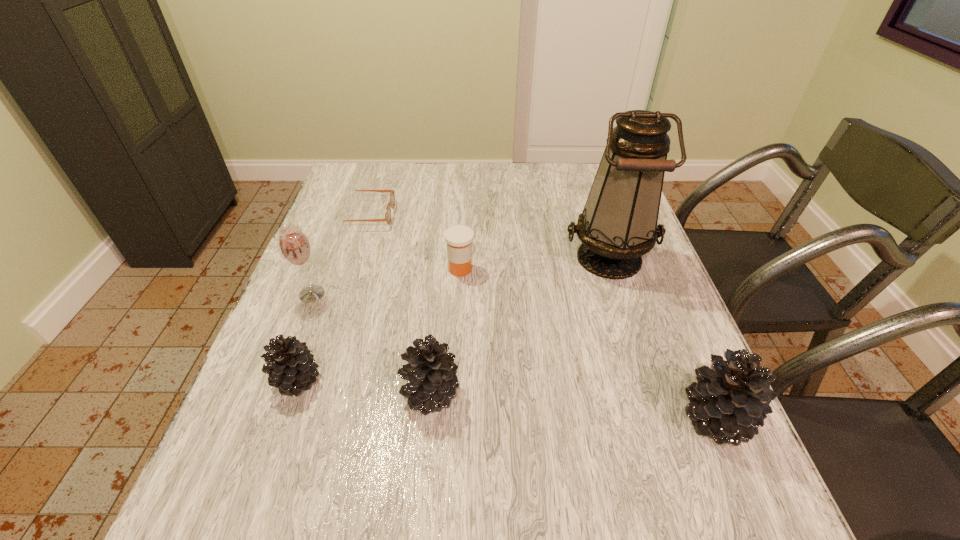
Locate an element on the screen. the leftmost pinecone is located at coordinates (291, 367).

Locate an element on the screen. the second pinecone from left to right is located at coordinates (431, 372).

The width and height of the screenshot is (960, 540). I want to click on the fourth tallest object, so click(x=431, y=372).

Where is `the rightmost pinecone`? the rightmost pinecone is located at coordinates click(x=729, y=402).

Where is `sunglasses`? Image resolution: width=960 pixels, height=540 pixels. sunglasses is located at coordinates (392, 198).

Find the location of a particular element. the shortest object is located at coordinates (392, 198).

The image size is (960, 540). In order to click on oil lamp in this screenshot , I will do `click(618, 225)`.

Where is `medicine`? The height and width of the screenshot is (540, 960). medicine is located at coordinates (459, 238).

Image resolution: width=960 pixels, height=540 pixels. I want to click on wineglass, so click(x=295, y=247).

Locate an element on the screen. The height and width of the screenshot is (540, 960). free space located 0.080m on the back of the shortest pinecone is located at coordinates (315, 330).